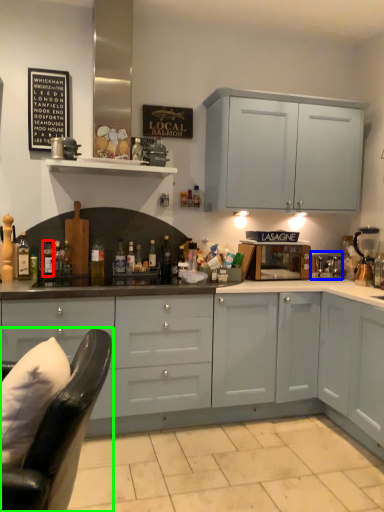
Question: Which object is positioned closest to bottle (highlighted by a red box)? Select from appliance (highlighted by a blue box) and swivel chair (highlighted by a green box).

Choices:
 (A) appliance
 (B) swivel chair

Answer: (A)